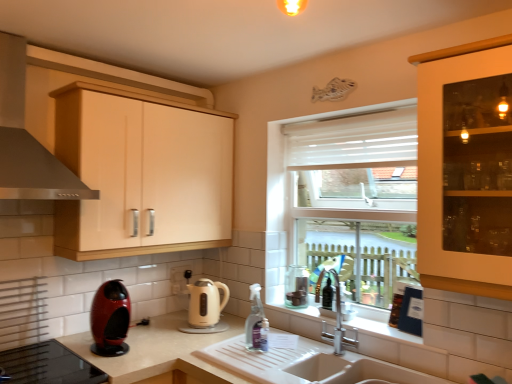
Where is `unoccupied region to the right of metallic red coffee machine at lower left`? The image size is (512, 384). unoccupied region to the right of metallic red coffee machine at lower left is located at coordinates (148, 347).